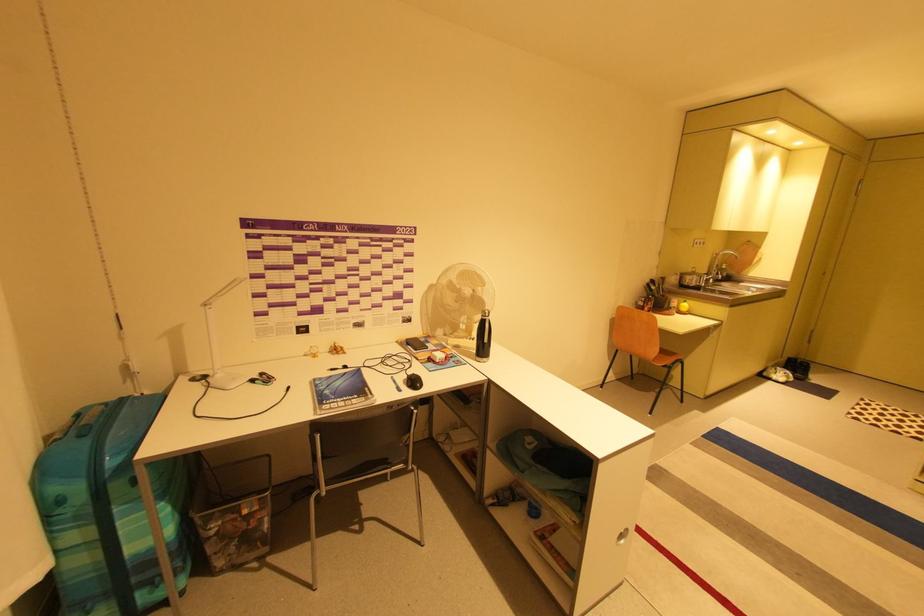
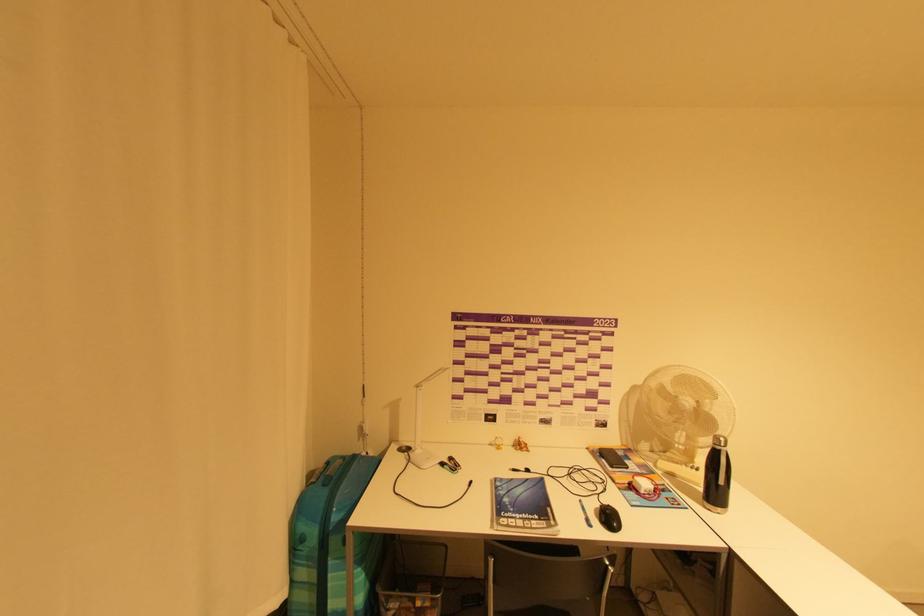
Where in the second image is the point corresponding to pixel 419 382 from the first image?

(614, 517)